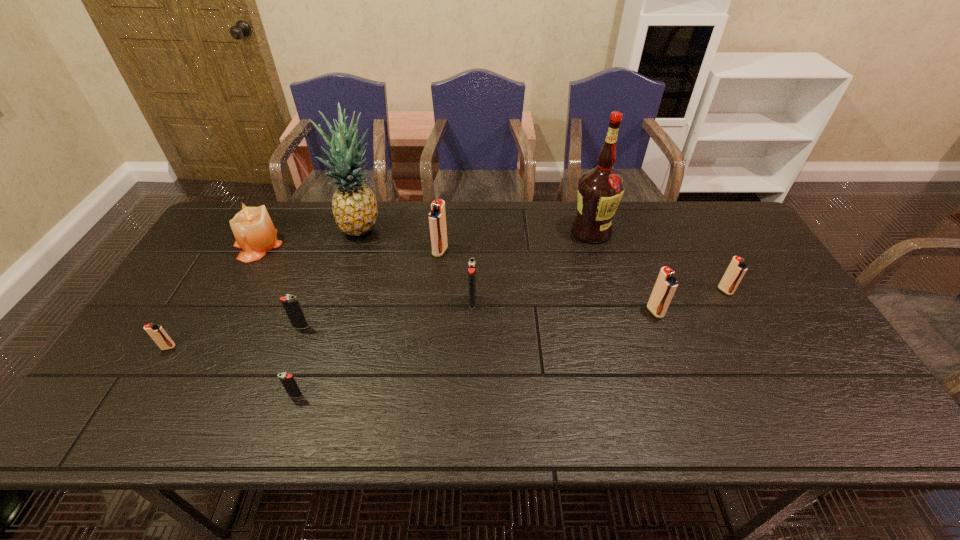
Locate an element on the screen. This screenshot has width=960, height=540. free space located on the front of the farthest igniter is located at coordinates (434, 319).

At what (x,y) coordinates should I click in order to perform the action: click on vacant space located 0.090m on the back of the candle. Please return your answer as a coordinate pair (x, y). This screenshot has width=960, height=540. Looking at the image, I should click on (276, 212).

At what (x,y) coordinates should I click in order to perform the action: click on vacant space situated 0.210m on the front of the third smallest red igniter. Please return your answer as a coordinate pair (x, y). Looking at the image, I should click on point(684,389).

Locate an element on the screen. This screenshot has width=960, height=540. vacant area situated 0.050m on the front of the rightmost black igniter is located at coordinates (472, 323).

Image resolution: width=960 pixels, height=540 pixels. In order to click on vacant point located 0.330m on the right of the second nearest black igniter in this screenshot , I will do `click(434, 327)`.

Locate an element on the screen. This screenshot has width=960, height=540. vacant space located on the front of the second farthest red igniter is located at coordinates (781, 395).

The height and width of the screenshot is (540, 960). Identify the location of free spot located on the front of the second nearest object. (145, 386).

The height and width of the screenshot is (540, 960). In order to click on free region located 0.230m on the left of the second black igniter from left to right in this screenshot , I will do `click(189, 396)`.

Locate an element on the screen. pineapple that is at the far edge is located at coordinates (354, 206).

Where is `alcohol at the far edge`? Image resolution: width=960 pixels, height=540 pixels. alcohol at the far edge is located at coordinates (600, 189).